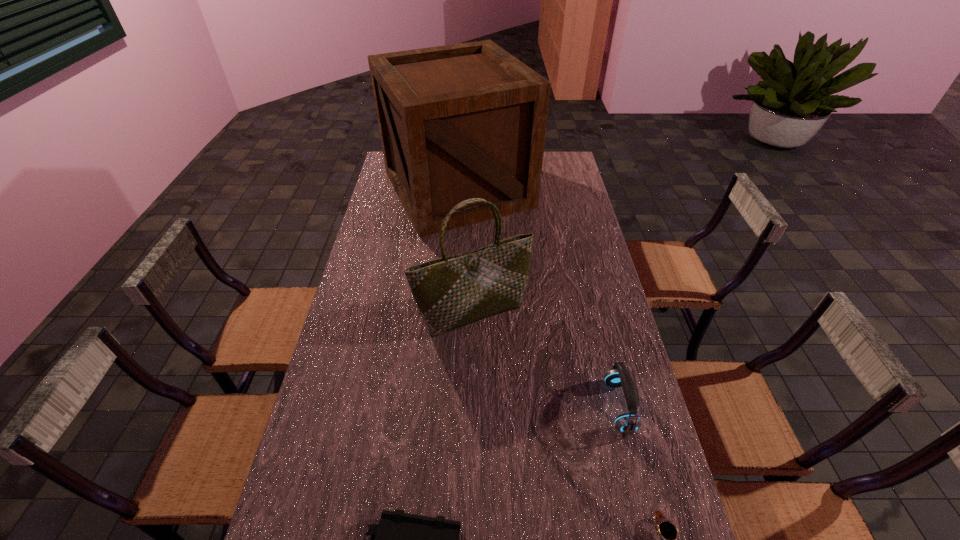
In order to click on box in this screenshot , I will do `click(462, 121)`.

Locate an element on the screen. The width and height of the screenshot is (960, 540). the farthest object is located at coordinates (462, 121).

This screenshot has height=540, width=960. I want to click on the fourth nearest object, so click(x=450, y=292).

Locate an element on the screen. The width and height of the screenshot is (960, 540). the second tallest object is located at coordinates coord(450,292).

Image resolution: width=960 pixels, height=540 pixels. What are the coordinates of `the third farthest object` in the screenshot? It's located at (618, 376).

You are a GUI agent. You are given a task and a screenshot of the screen. Output one action in this format:
    pyautogui.click(x=<x>, y=<y>)
    Task: Click on the third shortest object
    Image resolution: width=960 pixels, height=540 pixels.
    Given the screenshot: What is the action you would take?
    pyautogui.click(x=618, y=376)

You are a GUI agent. You are given a task and a screenshot of the screen. Output one action in this format:
    pyautogui.click(x=<x>, y=<y>)
    Task: Click on the free space located on the front of the tallest object
    
    Given the screenshot: What is the action you would take?
    pyautogui.click(x=450, y=310)

This screenshot has width=960, height=540. Identify the location of vacant space located on the front of the fourth nearest object. (471, 388).

At what (x,y) coordinates should I click in order to perform the action: click on free spot located 0.210m on the ear cups of the headset. Please return your answer as a coordinate pair (x, y). Image resolution: width=960 pixels, height=540 pixels. Looking at the image, I should click on (530, 407).

Locate an element on the screen. The width and height of the screenshot is (960, 540). vacant space situated on the ear cups of the headset is located at coordinates (570, 407).